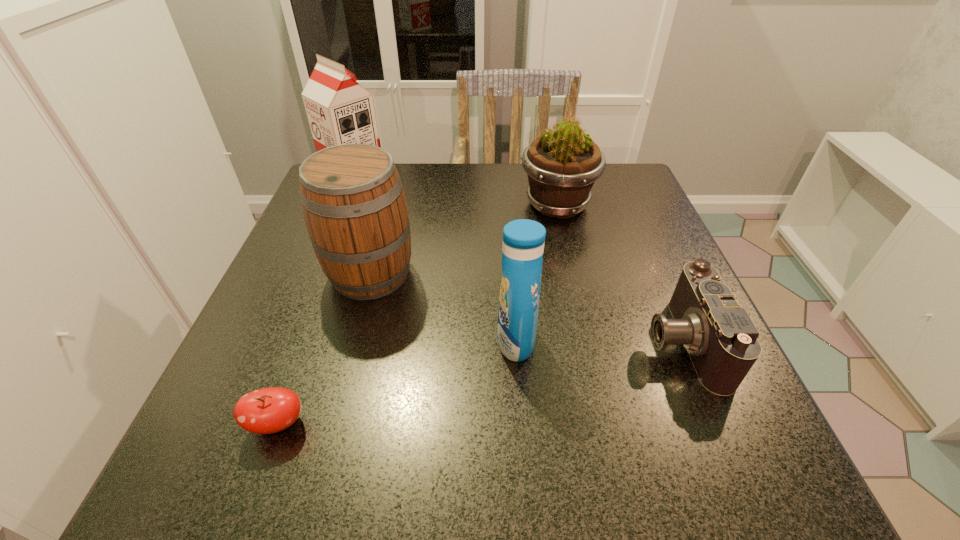
The height and width of the screenshot is (540, 960). Find the location of `the tallest object`. the tallest object is located at coordinates (340, 111).

This screenshot has width=960, height=540. Identify the location of flowerpot. (562, 164).

Where is `cider`? The width and height of the screenshot is (960, 540). cider is located at coordinates (352, 197).

At what (x,y) coordinates should I click in order to perform the action: click on detergent. Please return your answer as a coordinate pair (x, y). The height and width of the screenshot is (540, 960). Looking at the image, I should click on (523, 240).

Locate an element on the screen. The width and height of the screenshot is (960, 540). the rightmost object is located at coordinates (721, 339).

Locate an element on the screen. This screenshot has height=540, width=960. the fifth tallest object is located at coordinates (721, 339).

Locate an element on the screen. The width and height of the screenshot is (960, 540). apple is located at coordinates click(269, 410).

Where is `the shortest object`? the shortest object is located at coordinates (269, 410).

The height and width of the screenshot is (540, 960). I want to click on vacant region located 0.170m on the right of the tallest object, so click(x=452, y=182).

At what (x,y) coordinates should I click in order to perform the action: click on vacant area situated 0.120m on the front of the flowerpot. Please return your answer as a coordinate pair (x, y). The image size is (960, 540). Looking at the image, I should click on (570, 262).